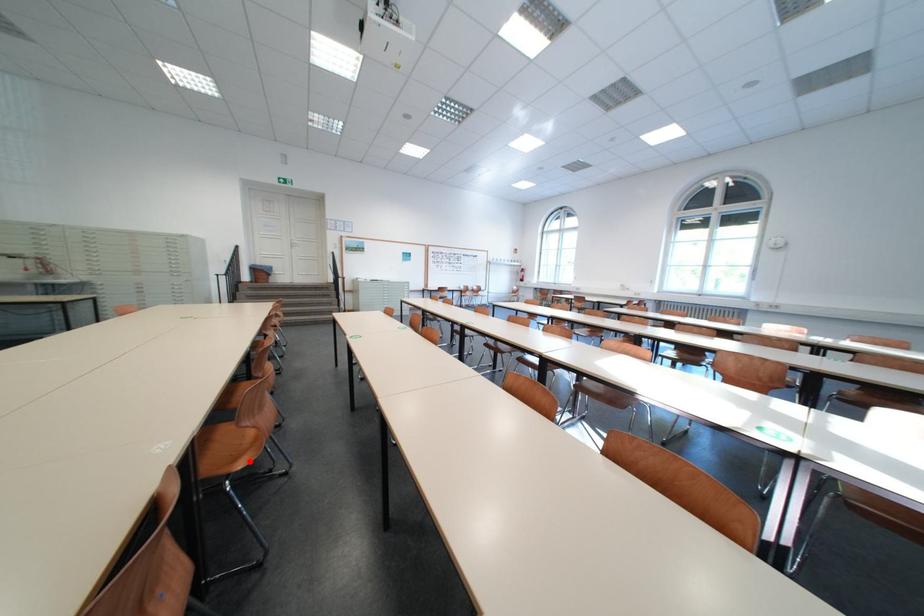
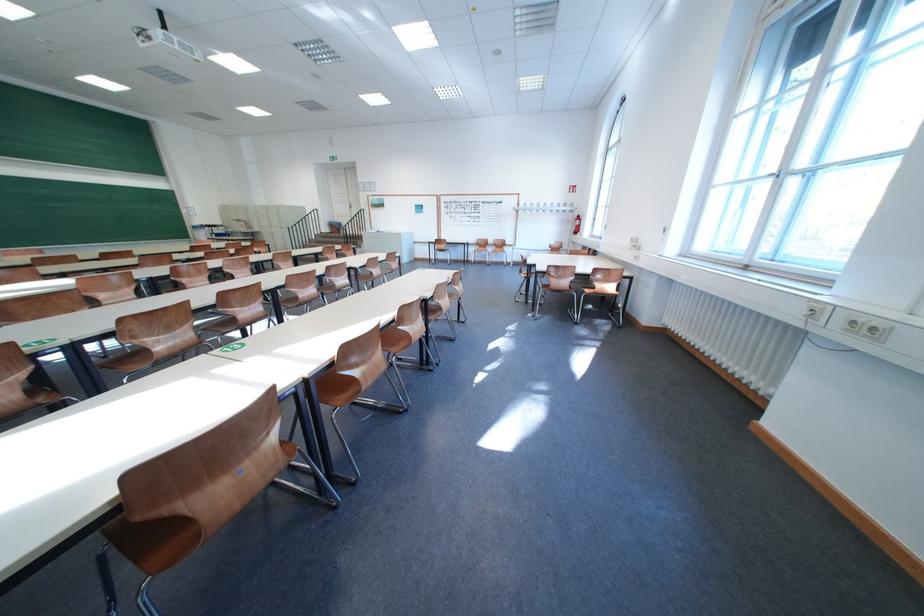
Question: I am providing you with two images of the same scene from different viewpoints. A red point is marked on the first image. Can you still see the location of the red point in image 2?

Choices:
 (A) Yes
 (B) No

Answer: (B)